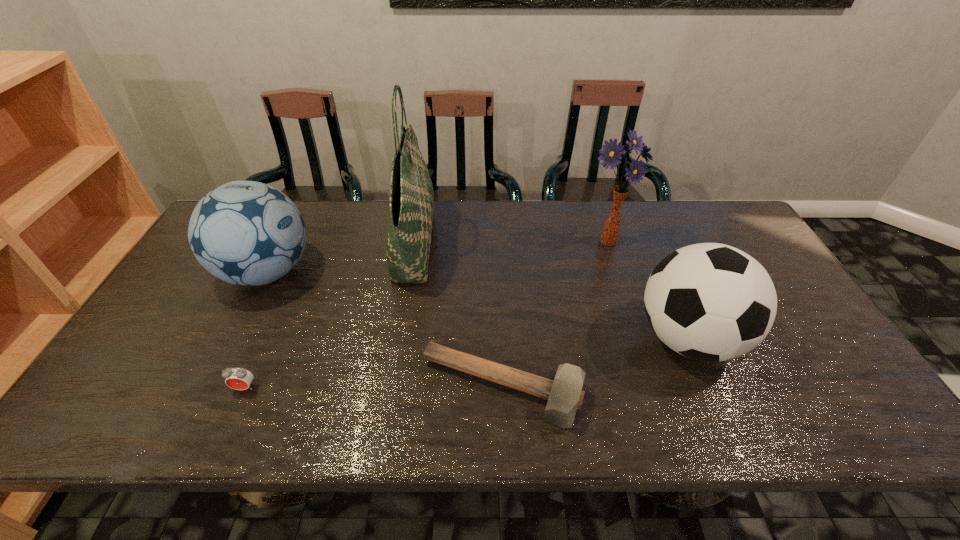
This screenshot has height=540, width=960. Find the location of `free space at the near edge of the desktop`. free space at the near edge of the desktop is located at coordinates (509, 434).

In the image, there is a desktop. Identify the location of vacant area at the left edge. Image resolution: width=960 pixels, height=540 pixels. (138, 394).

In order to click on vacant region at the right edge of the desktop in this screenshot , I will do `click(814, 334)`.

Identify the location of free spot at the far right corner of the desktop. (703, 238).

The width and height of the screenshot is (960, 540). I want to click on free point between the mallet and the flower arrangement, so click(x=556, y=315).

Locate an element on the screen. unoccupied position between the tote bag and the alarm clock is located at coordinates (329, 315).

Locate an element on the screen. unoccupied area between the left soccer ball and the mallet is located at coordinates (385, 330).

Locate an element on the screen. unoccupied area between the fourth object from left to right and the right soccer ball is located at coordinates (595, 363).

Where is `empty space that is in between the alarm clock and the tallest object`? This screenshot has width=960, height=540. empty space that is in between the alarm clock and the tallest object is located at coordinates (329, 315).

This screenshot has height=540, width=960. I want to click on vacant space that's between the left soccer ball and the second tallest object, so click(438, 257).